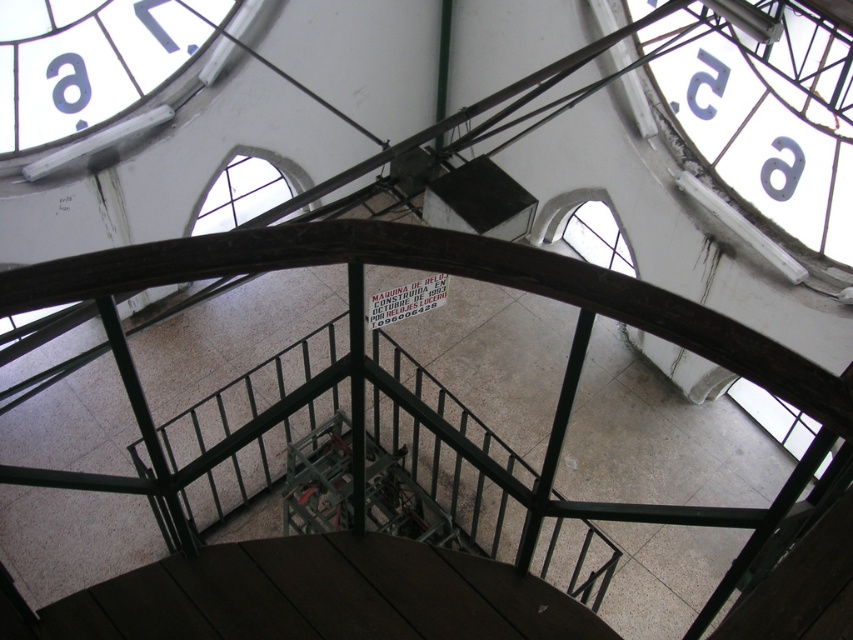
You are an architect reviewing the design of this spiral staircase in the clock tower. You need to ensure that the black matte letter at upper center and the black plastic number at upper right are visible from the bottom of the staircase. Considering their sizes, which one might be more easily seen from below?

The black plastic number at upper right is taller than the black matte letter at upper center, so it would be more easily seen from below.

You are standing at the bottom of the spiral staircase looking up. You need to locate the transparent glass window at center and the black plastic number at upper right. According to their positions, which object is closer to the right side of the staircase?

The black plastic number at upper right is closer to the right side of the staircase because the transparent glass window at center is to the right of it, meaning the number is positioned to the left of the window.